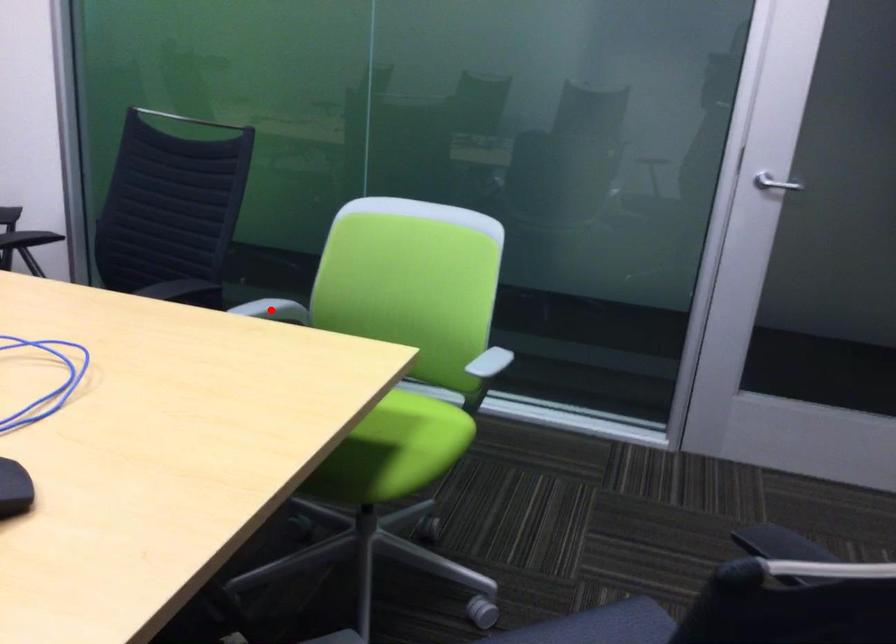
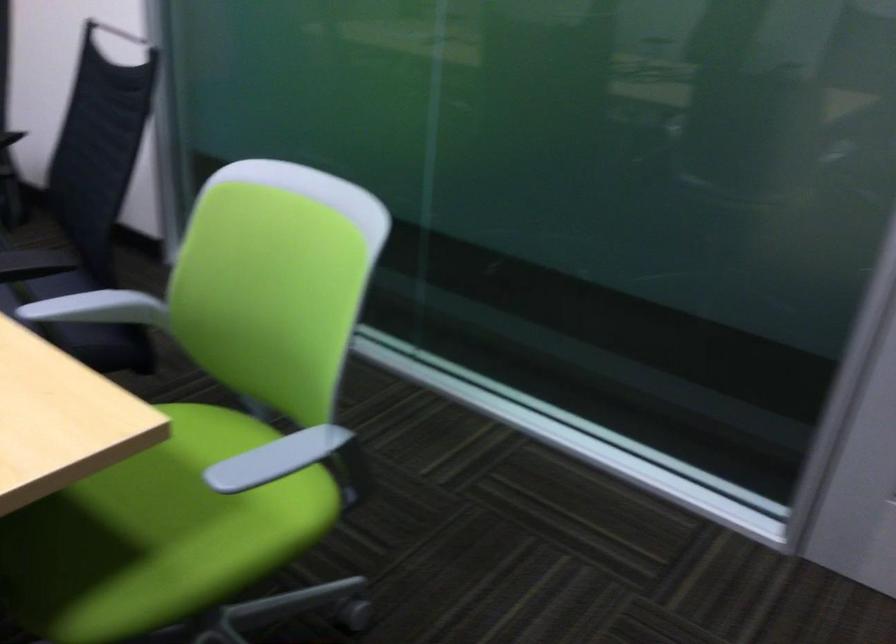
Where in the second image is the point corresponding to the highlighted location from the first image?

(97, 308)